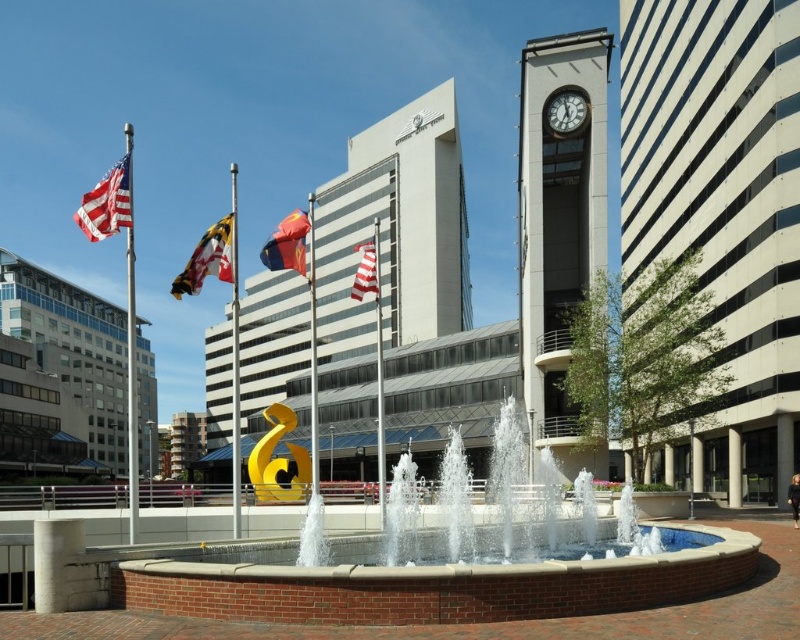
You are a tourist standing in front of the fountain and want to take a photo that includes both the white glass clock tower at upper right and the striped fabric flag at center. Based on their positions, will the clock tower appear higher up in the photo than the flag?

The white glass clock tower at upper right is located above the striped fabric flag at center, so in the photo, the clock tower will appear higher up than the flag.